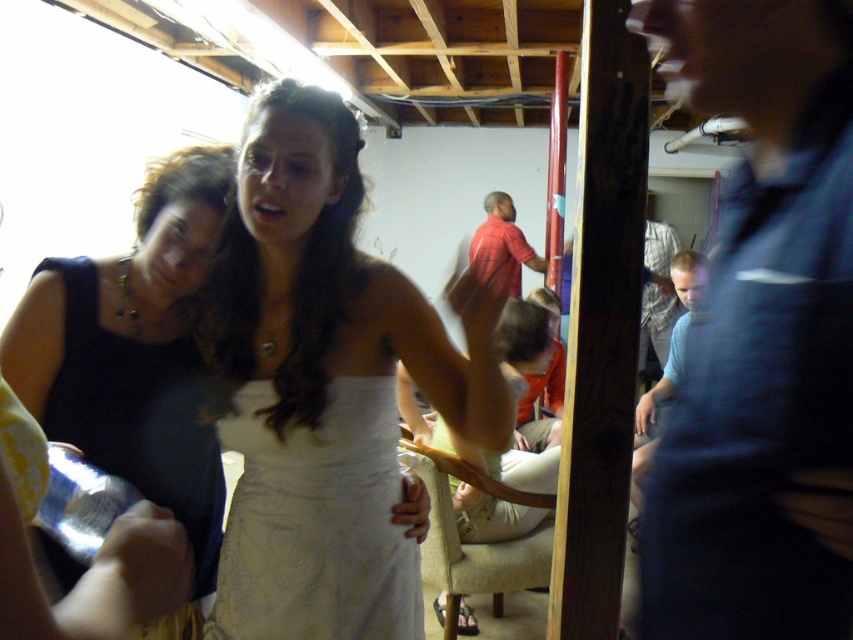
You are a photographer setting up for a group photo. You notice the white satin dress at center and the black satin dress at left. Which dress should you position closer to the camera to ensure both dresses are clearly visible in the photo?

The white satin dress at center is taller than the black satin dress at left, so positioning the black satin dress at left closer to the camera will ensure both are clearly visible without the taller dress blocking the shorter one.